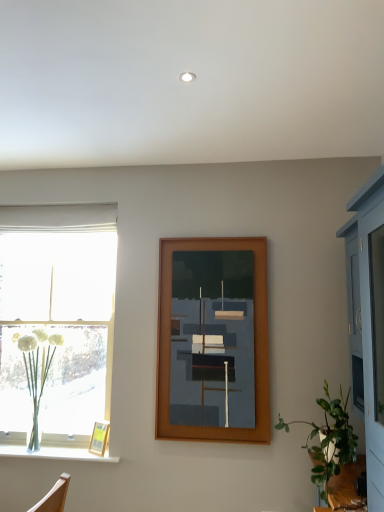
Where is `empty space that is ontop of clear glass vase at lower left (from a real-world perspective)`? This screenshot has height=512, width=384. empty space that is ontop of clear glass vase at lower left (from a real-world perspective) is located at coordinates (49, 450).